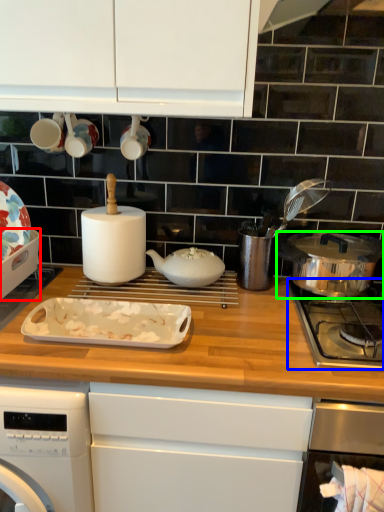
Question: Based on their relative distances, which object is farther from kitchen appliance (highlighted by a red box)? Choose from gas stove (highlighted by a blue box) and kitchen appliance (highlighted by a green box).

Choices:
 (A) gas stove
 (B) kitchen appliance

Answer: (B)